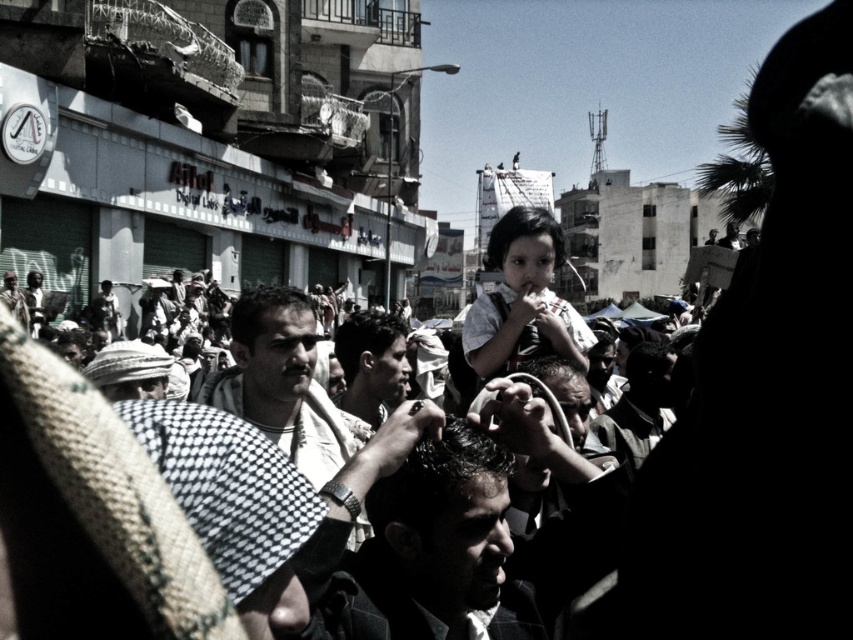
Question: Which point appears farthest from the camera in this image?

Choices:
 (A) pyautogui.click(x=390, y=580)
 (B) pyautogui.click(x=654, y=408)
 (C) pyautogui.click(x=543, y=321)
 (D) pyautogui.click(x=366, y=362)

Answer: (B)

Question: Does dark brown hair at center have a larger size compared to checkered fabric headscarf at center?

Choices:
 (A) yes
 (B) no

Answer: (B)

Question: Where is matte white shirt at center located in relation to smooth skin face at center in the image?

Choices:
 (A) right
 (B) left

Answer: (A)

Question: Is checkered fabric headscarf at center bigger than dark brown leather jacket at center?

Choices:
 (A) no
 (B) yes

Answer: (B)

Question: Based on their relative distances, which object is farther from the checkered fabric headscarf at center?

Choices:
 (A) dark brown hair at center
 (B) dark brown leather jacket at center

Answer: (B)

Question: Estimate the real-world distances between objects in this image. Which object is farther from the smooth skin face at center?

Choices:
 (A) dark brown hair at center
 (B) checkered fabric headscarf at center
 (C) matte white shirt at center
 (D) dark brown leather jacket at center

Answer: (D)